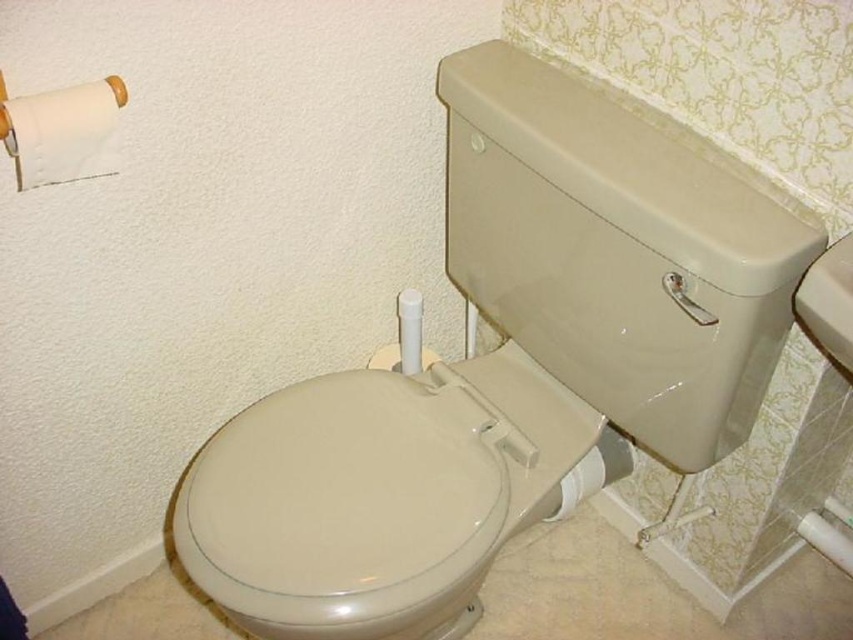
You are a bathroom designer and need to place a decorative plant between the white matte toilet paper at upper left and the white glossy toilet paper at lower right. Can the plant fit in the space between them if it requires 60 centimeters of space?

The white matte toilet paper at upper left and white glossy toilet paper at lower right are 78.11 centimeters apart from each other. Since the plant requires 60 centimeters of space, it can fit comfortably between them as the available space is larger than needed.

You are standing in the bathroom and want to determine the distance between the two points marked in the scene. Which point is closer to you, point [683,189] or point [592,468]?

Point [683,189] is closer to the camera than point [592,468], so the point closer to you is point [683,189].

You are standing in the bathroom and want to determine which of the two points, point (x=88, y=109) or point (x=602, y=433), is closer to you. Based on the scene, which point is nearer?

Point (x=88, y=109) is closer to the camera than point (x=602, y=433), so it is nearer to you.